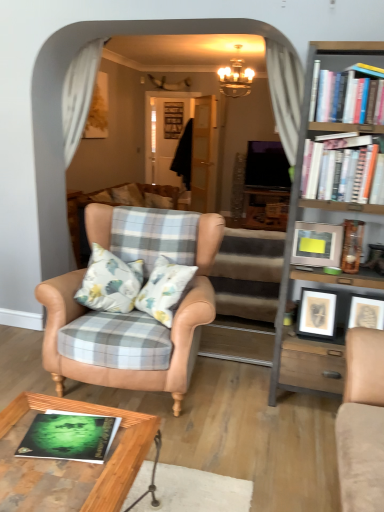
What is the approximate height of black fabric at center, the 1th glass door in the back-to-front sequence?

The height of black fabric at center, the 1th glass door in the back-to-front sequence, is 7.05 feet.

The height and width of the screenshot is (512, 384). I want to click on black fabric at center, the second glass door viewed from the front, so click(x=163, y=136).

In order to face wooden bookcase at right, should I rotate leftwards or rightwards?

Rotate your view right by about 20.137°.

Describe the element at coordinates (300, 222) in the screenshot. I see `wooden bookcase at right` at that location.

In order to face woodenwoodentable at lower center, should I rotate leftwards or rightwards?

A 17.229 degree turn to the left will do.

The height and width of the screenshot is (512, 384). I want to click on woodenwoodentable at lower center, so click(71, 462).

The width and height of the screenshot is (384, 512). I want to click on gold metallic chandelier at upper center, so click(235, 79).

Between plaid fabric couch at center and metallic silver picture frame at right, placed as the 2th picture frame when sorted from bottom to top, which one has less height?

metallic silver picture frame at right, placed as the 2th picture frame when sorted from bottom to top.

From a real-world perspective, between plaid fabric couch at center and metallic silver picture frame at right, placed as the 2th picture frame when sorted from bottom to top, who is vertically lower?

plaid fabric couch at center.

Considering the sizes of objects plaid fabric couch at center and metallic silver picture frame at right, placed as the 2th picture frame when sorted from bottom to top, in the image provided, who is smaller, plaid fabric couch at center or metallic silver picture frame at right, placed as the 2th picture frame when sorted from bottom to top,?

metallic silver picture frame at right, placed as the 2th picture frame when sorted from bottom to top.

The width and height of the screenshot is (384, 512). In order to click on studio couch below the metallic silver picture frame at right, placed as the 2th picture frame when sorted from bottom to top (from a real-world perspective) in this screenshot , I will do coord(83,219).

Considering the positions of points (236, 65) and (45, 433), is point (236, 65) farther from camera compared to point (45, 433)?

Yes, it is.

Who is shorter, gold metallic chandelier at upper center or green matte book at lower left, the 2th book when ordered from top to bottom?

Standing shorter between the two is green matte book at lower left, the 2th book when ordered from top to bottom.

Is green matte book at lower left, the 2th book viewed from the back, inside gold metallic chandelier at upper center?

That's incorrect, green matte book at lower left, the 2th book viewed from the back, is not inside gold metallic chandelier at upper center.

Between gold metallic chandelier at upper center and green matte book at lower left, the first book positioned from the front, which one has larger size?

Bigger between the two is gold metallic chandelier at upper center.

Can you confirm if white paperbacks at upper right, acting as the first book starting from the right, is smaller than black fabric at center, the 1th glass door in the back-to-front sequence?

Yes.

What's the angular difference between white paperbacks at upper right, acting as the 1th book starting from the back, and black fabric at center, the second glass door viewed from the front,'s facing directions?

0.451 degrees.

Does white paperbacks at upper right, acting as the 1th book starting from the back, have a greater height compared to black fabric at center, the second glass door viewed from the front?

No, white paperbacks at upper right, acting as the 1th book starting from the back, is not taller than black fabric at center, the second glass door viewed from the front.

Considering the relative positions of white paperbacks at upper right, acting as the 1th book starting from the back, and black fabric at center, the second glass door viewed from the front, in the image provided, is white paperbacks at upper right, acting as the 1th book starting from the back, to the left or to the right of black fabric at center, the second glass door viewed from the front,?

Clearly, white paperbacks at upper right, acting as the 1th book starting from the back, is on the right of black fabric at center, the second glass door viewed from the front, in the image.

Is gold metallic chandelier at upper center wider or thinner than woodenwoodentable at lower center?

Considering their sizes, gold metallic chandelier at upper center looks slimmer than woodenwoodentable at lower center.

The height and width of the screenshot is (512, 384). Identify the location of light fixture above the woodenwoodentable at lower center (from a real-world perspective). (235, 79).

From the picture: Does gold metallic chandelier at upper center come in front of woodenwoodentable at lower center?

No, it is not.

Is gold metallic chandelier at upper center looking in the opposite direction of woodenwoodentable at lower center?

No, gold metallic chandelier at upper center is not facing the opposite direction of woodenwoodentable at lower center.

Is gold metallic chandelier at upper center to the left of matte black picture frame at center right, placed as the 2th picture frame when sorted from top to bottom, from the viewer's perspective?

Correct, you'll find gold metallic chandelier at upper center to the left of matte black picture frame at center right, placed as the 2th picture frame when sorted from top to bottom.

Is matte black picture frame at center right, placed as the 2th picture frame when sorted from top to bottom, at the back of gold metallic chandelier at upper center?

gold metallic chandelier at upper center does not have its back to matte black picture frame at center right, placed as the 2th picture frame when sorted from top to bottom.

From the image's perspective, who appears lower, gold metallic chandelier at upper center or matte black picture frame at center right, placed as the 2th picture frame when sorted from top to bottom?

matte black picture frame at center right, placed as the 2th picture frame when sorted from top to bottom, is shown below in the image.

Considering the relative sizes of gold metallic chandelier at upper center and matte black picture frame at center right, placed as the 2th picture frame when sorted from top to bottom, in the image provided, is gold metallic chandelier at upper center thinner than matte black picture frame at center right, placed as the 2th picture frame when sorted from top to bottom,?

Incorrect, the width of gold metallic chandelier at upper center is not less than that of matte black picture frame at center right, placed as the 2th picture frame when sorted from top to bottom.

Based on the photo, is white paperbacks at upper right, arranged as the 2th book when viewed from the left, not within metallic silver picture frame at right, placed as the 2th picture frame when sorted from bottom to top?

Absolutely, white paperbacks at upper right, arranged as the 2th book when viewed from the left, is external to metallic silver picture frame at right, placed as the 2th picture frame when sorted from bottom to top.

Who is shorter, white paperbacks at upper right, arranged as the 2th book when viewed from the left, or metallic silver picture frame at right, placed as the 2th picture frame when sorted from bottom to top?

metallic silver picture frame at right, placed as the 2th picture frame when sorted from bottom to top.

From the white paperbacks at upper right, which is the 2th book in bottom-to-top order, count the 2nd picture frame to the left and point to it. Please provide its 2D coordinates.

[(317, 244)]

From the image's perspective, which object appears higher, white paperbacks at upper right, which is counted as the first book, starting from the top, or metallic silver picture frame at right, placed as the 2th picture frame when sorted from bottom to top?

white paperbacks at upper right, which is counted as the first book, starting from the top, appears higher in the image.

Considering the sizes of objects plaid fabric couch at center and gold metallic chandelier at upper center in the image provided, who is smaller, plaid fabric couch at center or gold metallic chandelier at upper center?

gold metallic chandelier at upper center is smaller.

Does plaid fabric couch at center appear on the left side of gold metallic chandelier at upper center?

Yes.

Is plaid fabric couch at center wider than gold metallic chandelier at upper center?

Yes.

From a real-world perspective, which object rests below the other?

From a 3D spatial view, plaid fabric couch at center is below.

Identify the location of picture frame that is the 1st one when counting forward from the plaid fabric couch at center. The width and height of the screenshot is (384, 512). (317, 244).

Where is `light fixture lying behind the green matte book at lower left, the first book positioned from the left`? The height and width of the screenshot is (512, 384). light fixture lying behind the green matte book at lower left, the first book positioned from the left is located at coordinates (235, 79).

From the image, which object appears to be nearer to metallic silver picture frame at right, which ranks as the 1th picture frame in top-to-bottom order, leather armchair at center or white paperbacks at upper right, arranged as the 2th book when viewed from the front?

Among the two, white paperbacks at upper right, arranged as the 2th book when viewed from the front, is located nearer to metallic silver picture frame at right, which ranks as the 1th picture frame in top-to-bottom order.

Estimate the real-world distances between objects in this image. Which object is further from green matte book at lower left, the first book positioned from the left, plaid fabric couch at center or woodenwoodentable at lower center?

plaid fabric couch at center lies further to green matte book at lower left, the first book positioned from the left, than the other object.

Looking at this image, looking at the image, which one is located further to wooden bookcase at right, gold metallic chandelier at upper center or matte black picture frame at center right, placed as the 2th picture frame when sorted from top to bottom?

Among the two, gold metallic chandelier at upper center is located further to wooden bookcase at right.

Estimate the real-world distances between objects in this image. Which object is further from metallic silver picture frame at right, placed as the 2th picture frame when sorted from bottom to top, white paperbacks at upper right, acting as the first book starting from the right, or matte black picture frame at center right, placed as the 2th picture frame when sorted from top to bottom?

The object further to metallic silver picture frame at right, placed as the 2th picture frame when sorted from bottom to top, is white paperbacks at upper right, acting as the first book starting from the right.

Based on their spatial positions, is green matte book at lower left, the first book positioned from the left, or matte black picture frame at center right, placed as the first picture frame when sorted from bottom to top, closer to black fabric at center, the second glass door viewed from the front?

Among the two, matte black picture frame at center right, placed as the first picture frame when sorted from bottom to top, is located nearer to black fabric at center, the second glass door viewed from the front.

From the image, which object appears to be nearer to green matte book at lower left, the first book positioned from the left, white glossy door at center, which is counted as the second glass door, starting from the back, or plaid fabric couch at center?

Based on the image, plaid fabric couch at center appears to be nearer to green matte book at lower left, the first book positioned from the left.

Based on their spatial positions, is woodenwoodentable at lower center or matte black picture frame at center right, placed as the first picture frame when sorted from bottom to top, further from black fabric at center, the second glass door viewed from the front?

Among the two, woodenwoodentable at lower center is located further to black fabric at center, the second glass door viewed from the front.

From the image, which object appears to be farther from metallic silver picture frame at right, which ranks as the 1th picture frame in top-to-bottom order, wooden bookcase at right or matte black picture frame at center right, placed as the first picture frame when sorted from bottom to top?

matte black picture frame at center right, placed as the first picture frame when sorted from bottom to top, lies further to metallic silver picture frame at right, which ranks as the 1th picture frame in top-to-bottom order, than the other object.

Locate an element on the screen. The image size is (384, 512). bookcase located between woodenwoodentable at lower center and gold metallic chandelier at upper center in the depth direction is located at coordinates (300, 222).

Where is `chair between wooden bookcase at right and plaid fabric couch at center in the front-back direction`? The image size is (384, 512). chair between wooden bookcase at right and plaid fabric couch at center in the front-back direction is located at coordinates (171, 330).

What are the coordinates of `bookcase between green matte book at lower left, placed as the first book when sorted from bottom to top, and gold metallic chandelier at upper center from front to back` in the screenshot? It's located at (300, 222).

Locate an element on the screen. The image size is (384, 512). light fixture located between white paperbacks at upper right, acting as the 1th book starting from the back, and black fabric at center, the second glass door viewed from the front, in the depth direction is located at coordinates (235, 79).